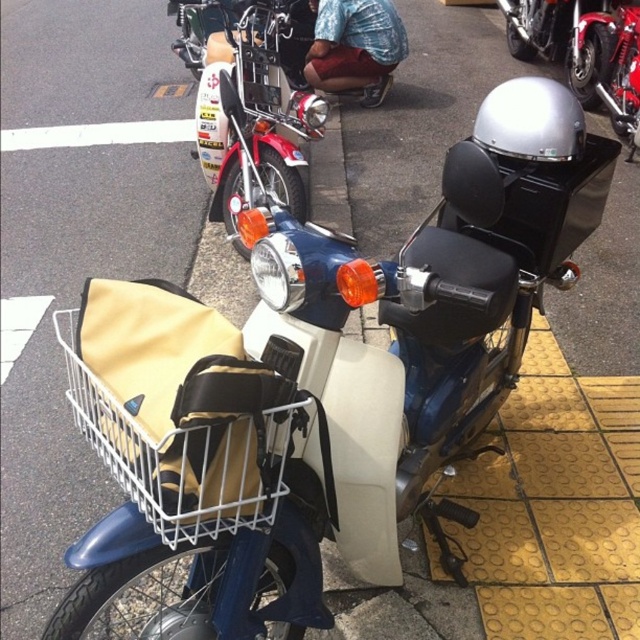
You are a delivery person who needs to measure the distance between the beige fabric basket at center and the shiny chrome helmet at upper right on the scooter. Can you confirm if the distance is more than 3 meters?

The distance between the beige fabric basket at center and the shiny chrome helmet at upper right is 3.88 meters, which is more than 3 meters.

You are a delivery person who needs to attach a GPS tracker to either the shiny chrome handlebars at upper center or the beige fabric basket at center. The tracker requires a wider surface to attach securely. Which object should you choose?

The shiny chrome handlebars at upper center should be chosen because its width is larger than the beige fabric basket at center, providing a wider surface for the GPS tracker to attach securely.